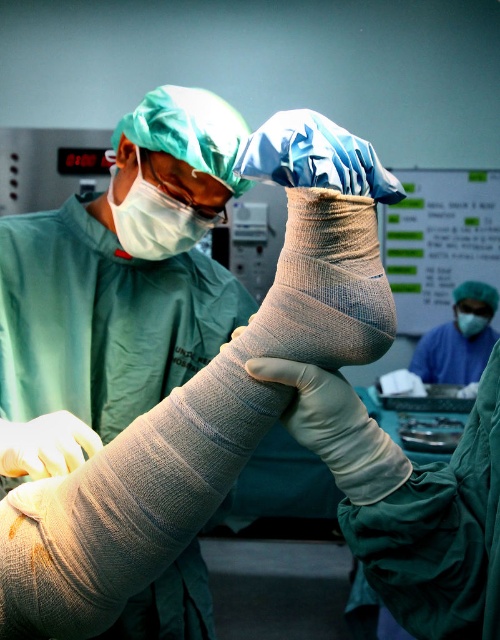
You are a medical student observing the surgical procedure. You notice two points marked in the scene. The first point is at coordinate point(19, 432) and the second is at point(475, 316). Which of these points is nearer to your viewpoint?

Point(19, 432) is closer to the camera than point(475, 316), so the first point is nearer to your viewpoint.

You are a medical student observing the surgical procedure. You notice the white matte mask at upper left and the smooth beige skin at lower left. Which object is closer to you, the observer?

The smooth beige skin at lower left is behind the white matte mask at upper left, so the white matte mask at upper left is closer to you.

In the surgical room scene, there is a patient with a bandaged arm and a medical professional wearing white gloves. There is also a smooth beige skin at lower left located at point (x=46, y=445). What is the location of the smooth beige skin at lower left?

The smooth beige skin at lower left is located at point (x=46, y=445).